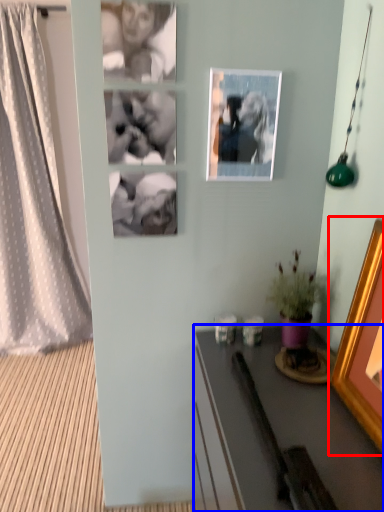
Question: Which point is closer to the camera, picture frame (highlighted by a red box) or desk (highlighted by a blue box)?

Choices:
 (A) picture frame
 (B) desk

Answer: (A)